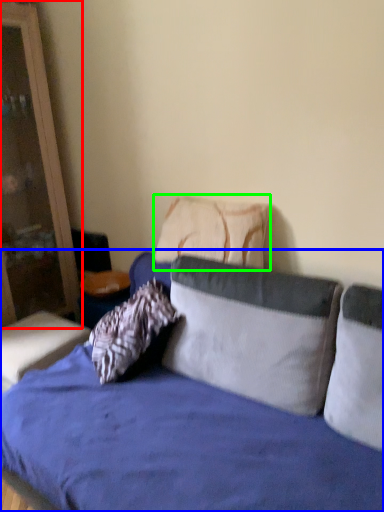
Question: Considering the real-world distances, which object is farthest from dresser (highlighted by a red box)? studio couch (highlighted by a blue box) or pillow (highlighted by a green box)?

Choices:
 (A) studio couch
 (B) pillow

Answer: (B)